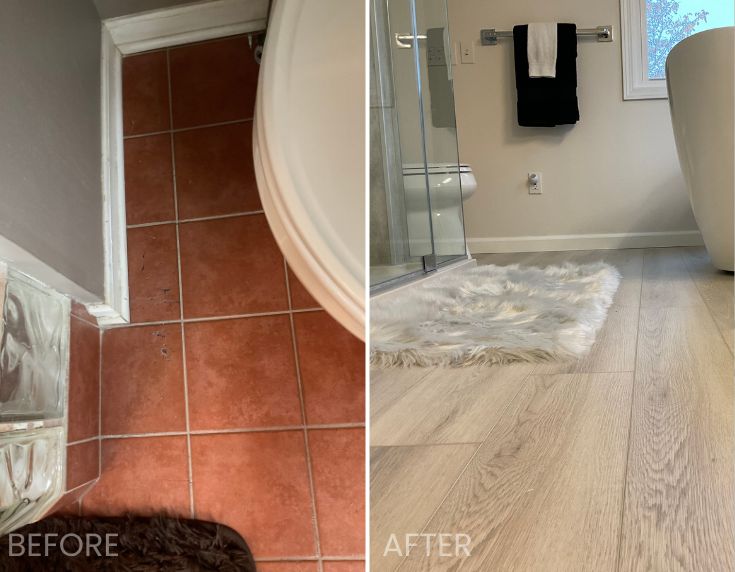
At what (x,y) coordinates should I click in order to perform the action: click on electrical outlet. Please return your answer as a coordinate pair (x, y). Looking at the image, I should click on 536,188.